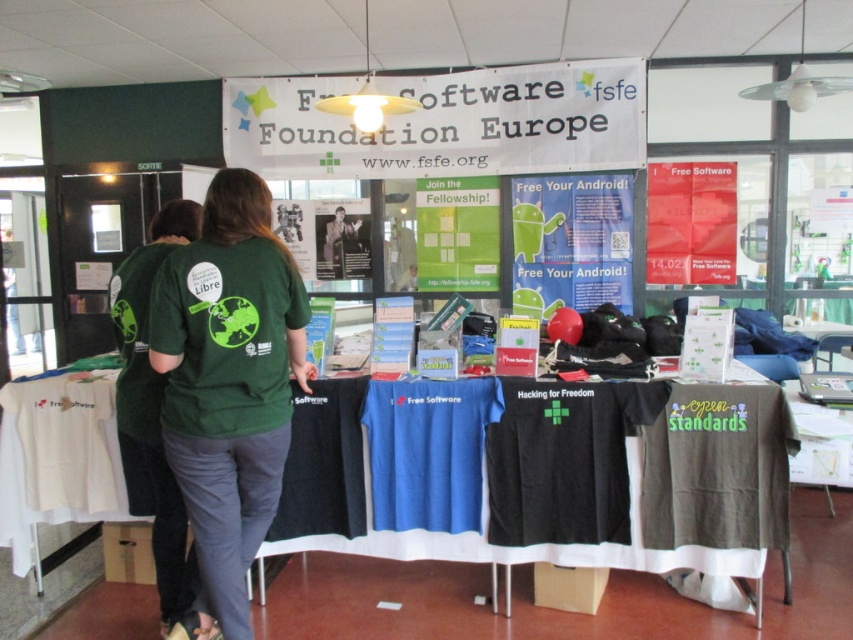
Question: Which point is farther from the camera taking this photo?

Choices:
 (A) (693, 209)
 (B) (334, 252)
 (C) (160, 358)

Answer: (B)

Question: Which point appears closest to the camera in this image?

Choices:
 (A) (490, 220)
 (B) (335, 212)

Answer: (A)

Question: Can you confirm if matte red poster at center is wider than matte black t-shirt at center?

Choices:
 (A) yes
 (B) no

Answer: (A)

Question: Among these points, which one is farthest from the camera?

Choices:
 (A) (271, 387)
 (B) (705, 228)

Answer: (B)

Question: Is blue paper poster at center smaller than matte black t-shirt at center?

Choices:
 (A) yes
 (B) no

Answer: (B)

Question: Is blue paper poster at center above matte red poster at center?

Choices:
 (A) no
 (B) yes

Answer: (A)